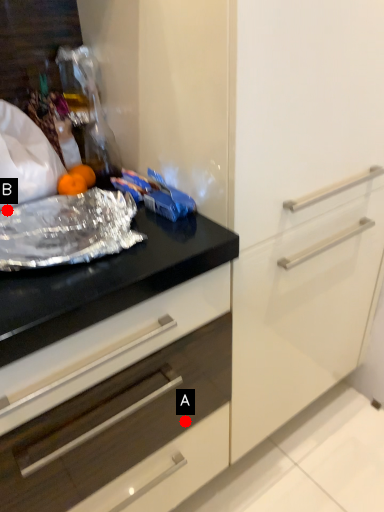
Question: Two points are circled on the image, labeled by A and B beside each circle. Which point appears closest to the camera in this image?

Choices:
 (A) A is closer
 (B) B is closer

Answer: (B)